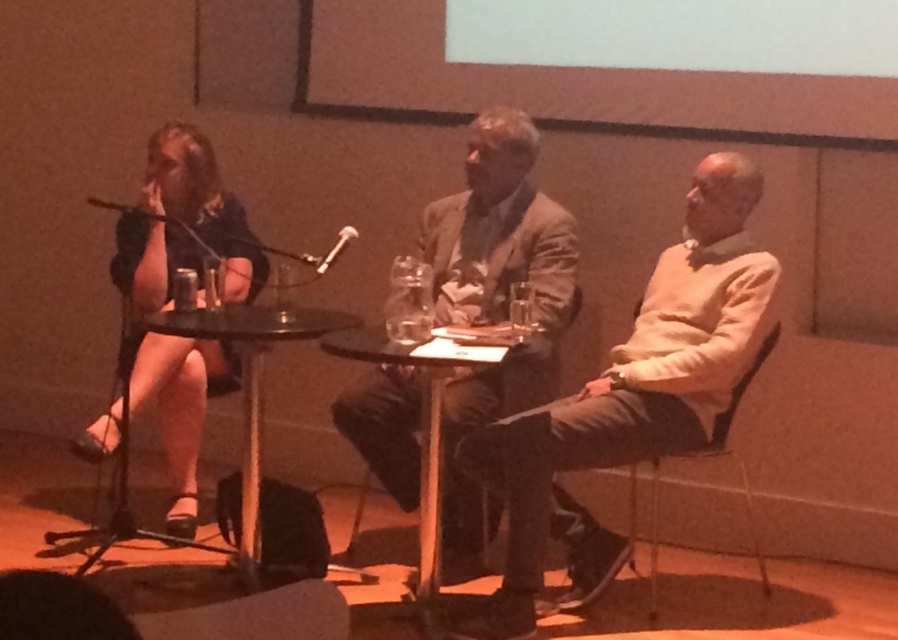
Does point (451, 262) come closer to viewer compared to point (430, 582)?

No, (451, 262) is further to viewer.

Between light brown leather jacket at center and black glass table at center, which one has more height?

light brown leather jacket at center

Image resolution: width=898 pixels, height=640 pixels. I want to click on light brown leather jacket at center, so click(x=495, y=300).

Between transparent glass table at center and metallic gray chair at right, which one is positioned higher?

transparent glass table at center is higher up.

Can you confirm if transparent glass table at center is positioned to the left of metallic gray chair at right?

Correct, you'll find transparent glass table at center to the left of metallic gray chair at right.

Locate an element on the screen. The image size is (898, 640). transparent glass table at center is located at coordinates (251, 380).

Does light brown sweater at right appear on the right side of transparent glass table at center?

Correct, you'll find light brown sweater at right to the right of transparent glass table at center.

Who is shorter, light brown sweater at right or transparent glass table at center?

With less height is transparent glass table at center.

Between point (619, 346) and point (357, 316), which one is positioned behind?

Positioned behind is point (357, 316).

You are a GUI agent. You are given a task and a screenshot of the screen. Output one action in this format:
    pyautogui.click(x=<x>, y=<y>)
    Task: Click on the light brown sweater at right
    This screenshot has width=898, height=640.
    Given the screenshot: What is the action you would take?
    pyautogui.click(x=634, y=381)